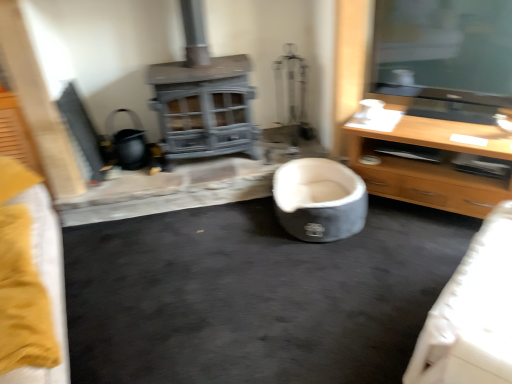
The image size is (512, 384). What are the coordinates of `blank space situated above light wood/finish tv stand at right (from a real-world perspective)` in the screenshot? It's located at (452, 123).